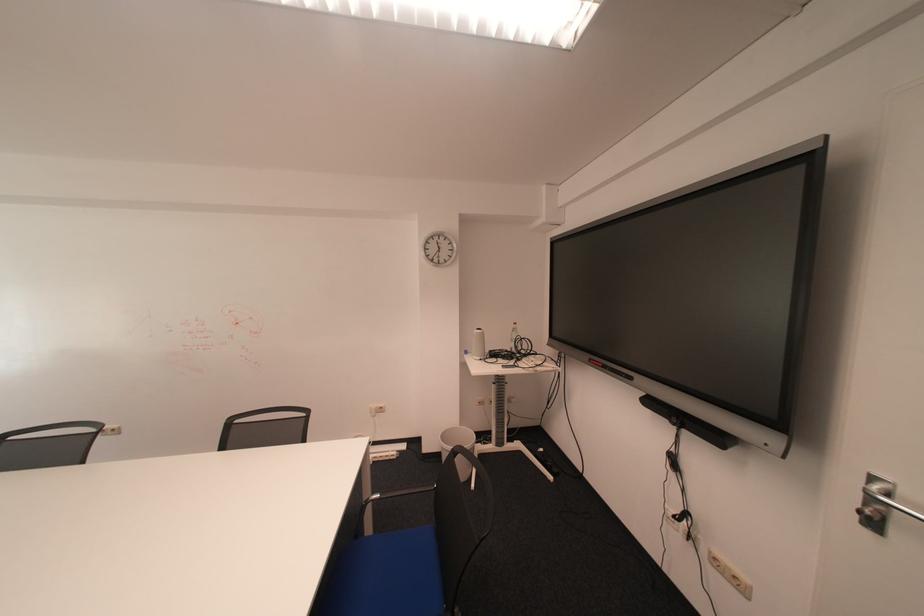
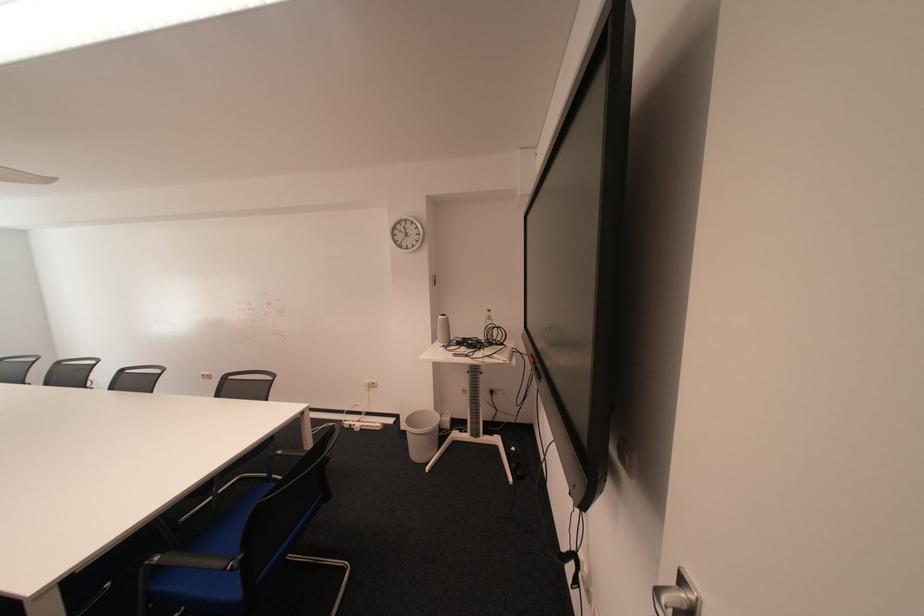
Question: Which direction would the cameraman need to move to produce the second image? Reply with the corresponding letter.

Choices:
 (A) Left
 (B) Right
 (C) Forward
 (D) Backward

Answer: (B)